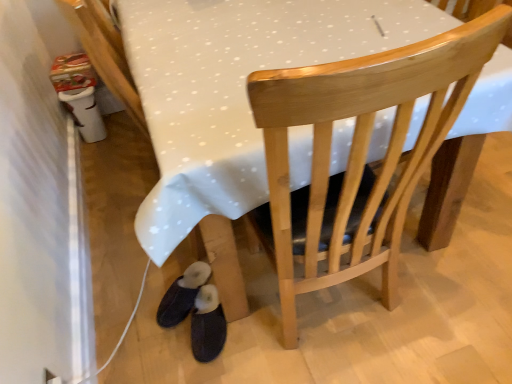
The width and height of the screenshot is (512, 384). Find the location of `vacant space in front of dark blue fabric slippers at lower left, marked as the 2th footwear in a left-to-right arrangement`. vacant space in front of dark blue fabric slippers at lower left, marked as the 2th footwear in a left-to-right arrangement is located at coordinates (219, 367).